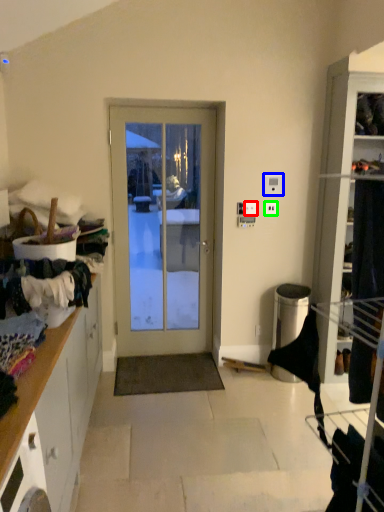
Question: Considering the real-world distances, which object is farthest from light switch (highlighted by a red box)? light switch (highlighted by a blue box) or electric outlet (highlighted by a green box)?

Choices:
 (A) light switch
 (B) electric outlet

Answer: (A)